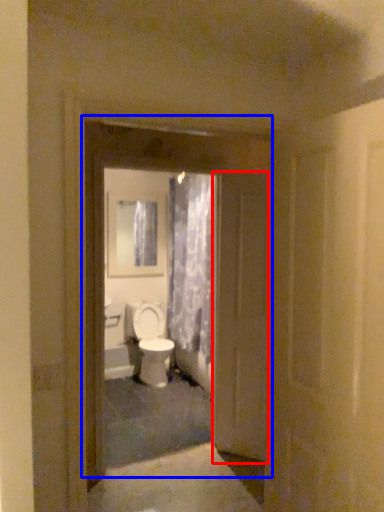
Question: Which of the following is the closest to the observer, door (highlighted by a red box) or door (highlighted by a blue box)?

Choices:
 (A) door
 (B) door

Answer: (B)